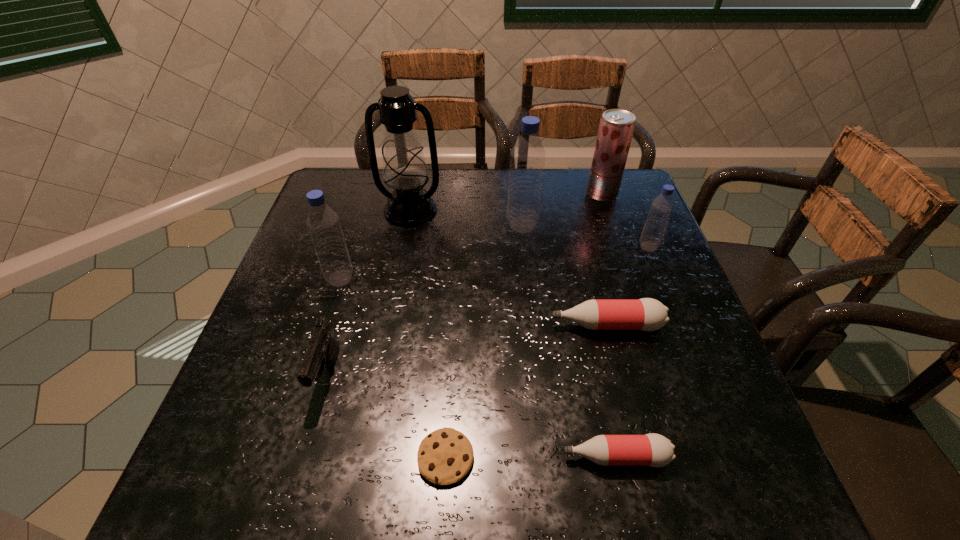
What are the coordinates of `vacant position in the image that satisfies the following two spatial constraints: 1. on the front side of the fruit juice; 2. with the cap open on the second shortest object` in the screenshot? It's located at 691,457.